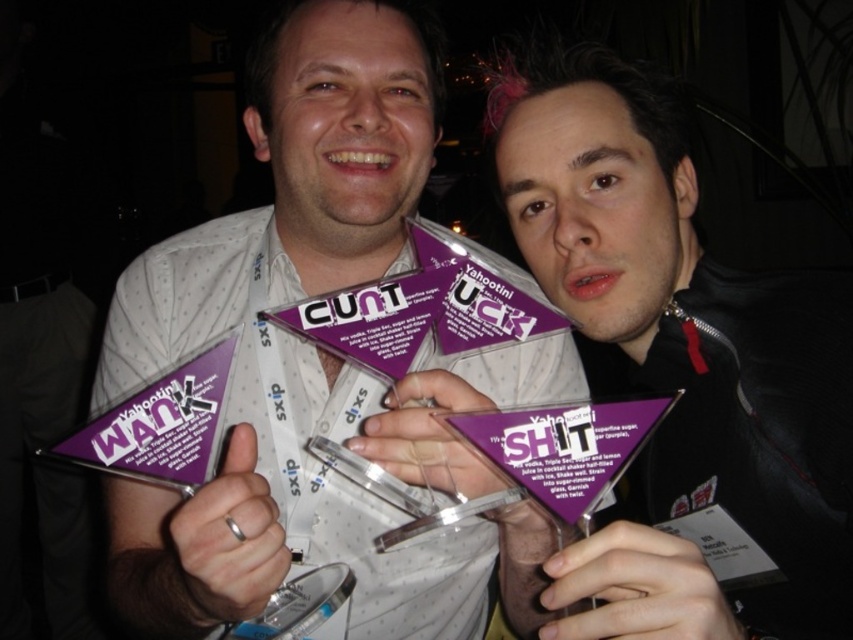
Question: Among these points, which one is nearest to the camera?

Choices:
 (A) (556, 182)
 (B) (299, 253)

Answer: (A)

Question: Does purple glossy triangle at center have a smaller size compared to purple paper award at center?

Choices:
 (A) yes
 (B) no

Answer: (B)

Question: Can you confirm if purple glossy triangle at center is positioned to the left of purple paper award at center?

Choices:
 (A) yes
 (B) no

Answer: (A)

Question: Does purple glossy triangle at center appear over purple paper award at center?

Choices:
 (A) yes
 (B) no

Answer: (B)